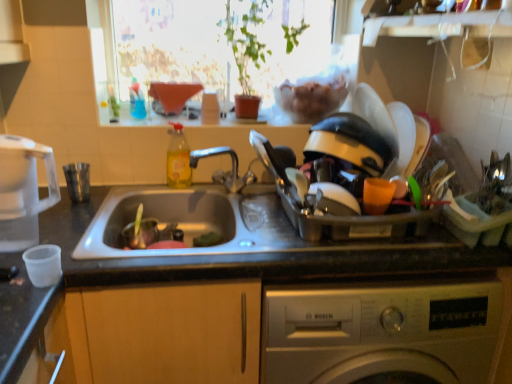
Locate an element on the screen. shiny plastic dish rack at right, the 1th appliance when ordered from right to left is located at coordinates (333, 206).

Describe the element at coordinates (380, 332) in the screenshot. I see `silver metallic washing machine at lower center` at that location.

I want to click on silver metallic washing machine at lower center, so click(x=380, y=332).

The width and height of the screenshot is (512, 384). What do you see at coordinates (23, 191) in the screenshot?
I see `transparent plastic kettle at left, which ranks as the first appliance in left-to-right order` at bounding box center [23, 191].

In order to face transparent plastic kettle at left, which ranks as the first appliance in left-to-right order, should I rotate leftwards or rightwards?

To align with it, rotate left about 29.241°.

What is the approximate width of transparent glass window at upper center?

5.66 inches.

What do you see at coordinates (223, 264) in the screenshot?
I see `metallic gray sink at center` at bounding box center [223, 264].

Locate an element on the screen. This screenshot has height=384, width=512. translucent yellow liquid at sink left is located at coordinates (178, 159).

In order to face translucent yellow liquid at sink left, should I rotate leftwards or rightwards?

Turn left approximately 9.905 degrees to face it.

Identify the location of shiny plastic dish rack at right, the 1th appliance when ordered from right to left. The height and width of the screenshot is (384, 512). (333, 206).

Is there a large distance between translucent yellow liquid at sink left and silver metallic washing machine at lower center?

No, translucent yellow liquid at sink left is not far from silver metallic washing machine at lower center.

Is translucent yellow liquid at sink left aimed at silver metallic washing machine at lower center?

No.

Which of these two, transparent glass window at upper center or metallic gray sink at center, is wider?

metallic gray sink at center is wider.

Based on the photo, is transparent glass window at upper center far away from metallic gray sink at center?

That's not correct — transparent glass window at upper center is a little close to metallic gray sink at center.

Which object is more forward, transparent glass window at upper center or metallic gray sink at center?

metallic gray sink at center is closer to the camera.

Considering the relative sizes of metallic gray sink at center and silver metallic washing machine at lower center in the image provided, is metallic gray sink at center wider than silver metallic washing machine at lower center?

Incorrect, the width of metallic gray sink at center does not surpass that of silver metallic washing machine at lower center.

Is metallic gray sink at center positioned far away from silver metallic washing machine at lower center?

No, metallic gray sink at center is not far from silver metallic washing machine at lower center.

From a real-world perspective, who is located higher, metallic gray sink at center or silver metallic washing machine at lower center?

metallic gray sink at center is physically above.

Can you confirm if metallic gray sink at center is taller than silver metallic washing machine at lower center?

Incorrect, the height of metallic gray sink at center is not larger of that of silver metallic washing machine at lower center.

From the image's perspective, is transparent glass window at upper center located above or below shiny plastic dish rack at right, marked as the 2th appliance in a left-to-right arrangement?

transparent glass window at upper center is above shiny plastic dish rack at right, marked as the 2th appliance in a left-to-right arrangement.

Is transparent glass window at upper center shorter than shiny plastic dish rack at right, the 1th appliance when ordered from right to left?

No, transparent glass window at upper center is not shorter than shiny plastic dish rack at right, the 1th appliance when ordered from right to left.

Looking at their sizes, would you say transparent glass window at upper center is wider or thinner than shiny plastic dish rack at right, the 1th appliance when ordered from right to left?

Considering their sizes, transparent glass window at upper center looks slimmer than shiny plastic dish rack at right, the 1th appliance when ordered from right to left.

Which of these two, transparent glass window at upper center or shiny plastic dish rack at right, the 1th appliance when ordered from right to left, is smaller?

Smaller between the two is transparent glass window at upper center.

From a real-world perspective, who is located higher, translucent yellow liquid at sink left or metallic gray sink at center?

translucent yellow liquid at sink left is physically above.

Is translucent yellow liquid at sink left next to metallic gray sink at center?

No, translucent yellow liquid at sink left is not in contact with metallic gray sink at center.

Considering the sizes of translucent yellow liquid at sink left and metallic gray sink at center in the image, is translucent yellow liquid at sink left wider or thinner than metallic gray sink at center?

In the image, translucent yellow liquid at sink left appears to be more narrow than metallic gray sink at center.

From the image's perspective, would you say translucent yellow liquid at sink left is shown under metallic gray sink at center?

Incorrect, from the image's perspective, translucent yellow liquid at sink left is higher than metallic gray sink at center.

In the scene shown: Would you say silver metallic washing machine at lower center is part of transparent glass window at upper center's contents?

Definitely not — silver metallic washing machine at lower center is not inside transparent glass window at upper center.

Can you tell me how much transparent glass window at upper center and silver metallic washing machine at lower center differ in facing direction?

2.9 degrees.

Which of these two, transparent glass window at upper center or silver metallic washing machine at lower center, is thinner?

transparent glass window at upper center is thinner.

Measure the distance between transparent glass window at upper center and silver metallic washing machine at lower center.

A distance of 34.64 inches exists between transparent glass window at upper center and silver metallic washing machine at lower center.

Looking at their sizes, would you say metallic gray sink at center is wider or thinner than shiny plastic dish rack at right, the 1th appliance when ordered from right to left?

metallic gray sink at center is wider than shiny plastic dish rack at right, the 1th appliance when ordered from right to left.

Considering the positions of objects metallic gray sink at center and shiny plastic dish rack at right, the 1th appliance when ordered from right to left, in the image provided, who is behind, metallic gray sink at center or shiny plastic dish rack at right, the 1th appliance when ordered from right to left,?

metallic gray sink at center is more distant.

Considering the relative positions of metallic gray sink at center and shiny plastic dish rack at right, the 1th appliance when ordered from right to left, in the image provided, is metallic gray sink at center to the left of shiny plastic dish rack at right, the 1th appliance when ordered from right to left, from the viewer's perspective?

Correct, you'll find metallic gray sink at center to the left of shiny plastic dish rack at right, the 1th appliance when ordered from right to left.

Identify the location of the 1st appliance in front of the metallic gray sink at center. (333, 206).

Where is `bottle above the silver metallic washing machine at lower center (from a real-world perspective)`? The image size is (512, 384). bottle above the silver metallic washing machine at lower center (from a real-world perspective) is located at coordinates (178, 159).

This screenshot has width=512, height=384. In order to click on countertop below the transparent glass window at upper center (from the image's perspective) in this screenshot , I will do `click(223, 264)`.

When comparing their distances from silver metallic washing machine at lower center, does shiny plastic dish rack at right, the 1th appliance when ordered from right to left, or transparent glass window at upper center seem closer?

Among the two, shiny plastic dish rack at right, the 1th appliance when ordered from right to left, is located nearer to silver metallic washing machine at lower center.

Based on their spatial positions, is metallic gray sink at center or silver metallic washing machine at lower center closer to shiny plastic dish rack at right, marked as the 2th appliance in a left-to-right arrangement?

Among the two, metallic gray sink at center is located nearer to shiny plastic dish rack at right, marked as the 2th appliance in a left-to-right arrangement.

Which object lies nearer to the anchor point transparent glass window at upper center, transparent plastic kettle at left, which ranks as the first appliance in left-to-right order, or shiny plastic dish rack at right, marked as the 2th appliance in a left-to-right arrangement?

Based on the image, shiny plastic dish rack at right, marked as the 2th appliance in a left-to-right arrangement, appears to be nearer to transparent glass window at upper center.

Looking at the image, which one is located closer to metallic gray sink at center, transparent plastic kettle at left, which ranks as the first appliance in left-to-right order, or transparent glass window at upper center?

Among the two, transparent plastic kettle at left, which ranks as the first appliance in left-to-right order, is located nearer to metallic gray sink at center.

Which object lies further to the anchor point transparent glass window at upper center, silver metallic washing machine at lower center or metallic gray sink at center?

silver metallic washing machine at lower center lies further to transparent glass window at upper center than the other object.

Estimate the real-world distances between objects in this image. Which object is closer to transparent plastic kettle at left, the second appliance when ordered from right to left, transparent glass window at upper center or silver metallic washing machine at lower center?

transparent glass window at upper center lies closer to transparent plastic kettle at left, the second appliance when ordered from right to left, than the other object.

When comparing their distances from metallic gray sink at center, does translucent yellow liquid at sink left or shiny plastic dish rack at right, the 1th appliance when ordered from right to left, seem further?

The object further to metallic gray sink at center is translucent yellow liquid at sink left.

Considering their positions, is silver metallic washing machine at lower center positioned further to translucent yellow liquid at sink left than transparent plastic kettle at left, the second appliance when ordered from right to left?

The object further to translucent yellow liquid at sink left is silver metallic washing machine at lower center.

You are a GUI agent. You are given a task and a screenshot of the screen. Output one action in this format:
    pyautogui.click(x=<x>, y=<y>)
    Task: Click on the bottle between transparent plastic kettle at left, which ranks as the first appliance in left-to-right order, and metallic gray sink at center, in the horizontal direction
    
    Given the screenshot: What is the action you would take?
    pyautogui.click(x=178, y=159)

This screenshot has height=384, width=512. Identify the location of bottle situated between transparent plastic kettle at left, the second appliance when ordered from right to left, and shiny plastic dish rack at right, the 1th appliance when ordered from right to left, from left to right. (178, 159).

Locate an element on the screen. bottle between transparent plastic kettle at left, the second appliance when ordered from right to left, and silver metallic washing machine at lower center is located at coordinates (178, 159).

You are a GUI agent. You are given a task and a screenshot of the screen. Output one action in this format:
    pyautogui.click(x=<x>, y=<y>)
    Task: Click on the bottle between transparent glass window at upper center and metallic gray sink at center in the up-down direction
    The height and width of the screenshot is (384, 512).
    Given the screenshot: What is the action you would take?
    pyautogui.click(x=178, y=159)